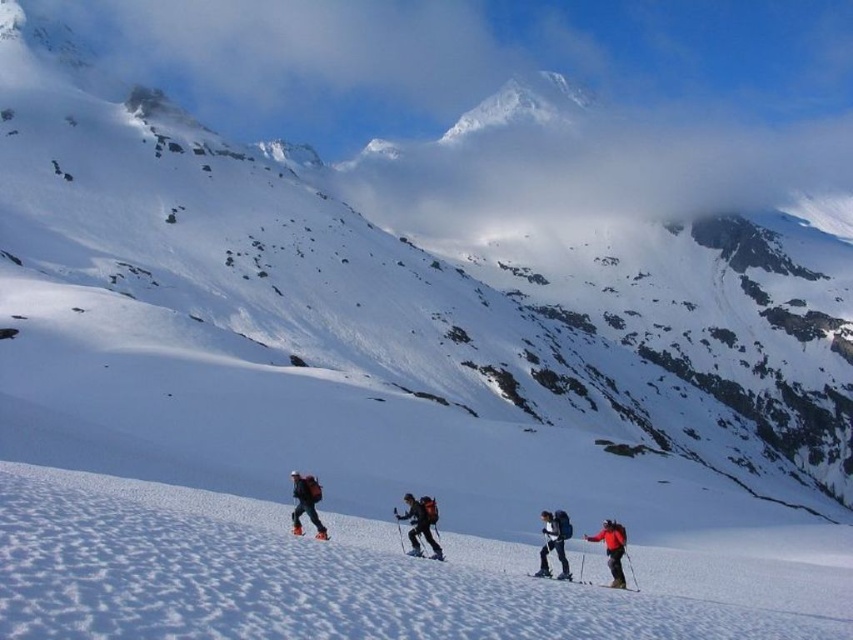
Question: Is red matte jacket at lower right behind white matte ski at lower center?

Choices:
 (A) yes
 (B) no

Answer: (B)

Question: Can you confirm if red backpack at center is positioned below matte black ski at lower center?

Choices:
 (A) yes
 (B) no

Answer: (B)

Question: Estimate the real-world distances between objects in this image. Which object is closer to the red backpack at center?

Choices:
 (A) matte black ski at lower center
 (B) white snow at center
 (C) matte black ski at center
 (D) red matte jacket at lower right

Answer: (A)

Question: Which of the following is the closest to the observer?

Choices:
 (A) white snow at center
 (B) matte black ski at lower right

Answer: (A)

Question: From the image, what is the correct spatial relationship of white snow at center in relation to white matte ski at lower center?

Choices:
 (A) below
 (B) above

Answer: (A)

Question: Which point is farther from the camera taking this photo?

Choices:
 (A) (585, 584)
 (B) (415, 554)

Answer: (A)